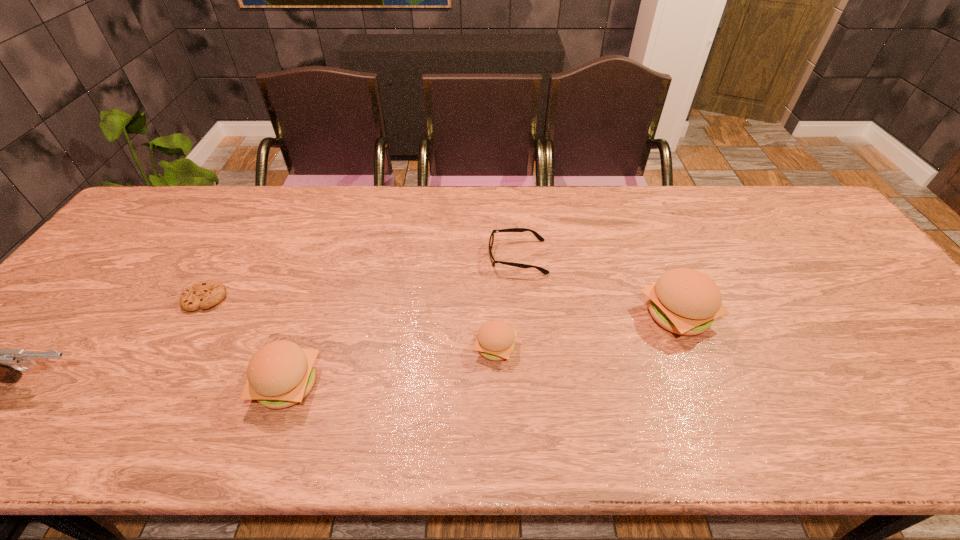
At what (x,y) coordinates should I click in order to perform the action: click on hamburger that is the closest to the shortest hamburger. Please return your answer as a coordinate pair (x, y). The width and height of the screenshot is (960, 540). Looking at the image, I should click on (684, 301).

Point out which hamburger is positioned as the second nearest to the leftmost hamburger. Please provide its 2D coordinates. Your answer should be formatted as a tuple, i.e. [(x, y)], where the tuple contains the x and y coordinates of a point satisfying the conditions above.

[(684, 301)]

The width and height of the screenshot is (960, 540). What are the coordinates of `free location that satisfies the following two spatial constraints: 1. on the front-facing side of the rightmost object; 2. on the left side of the spectacles` in the screenshot? It's located at point(522,315).

Image resolution: width=960 pixels, height=540 pixels. I want to click on vacant point that satisfies the following two spatial constraints: 1. on the front-facing side of the spectacles; 2. on the front side of the third shortest object, so click(525, 347).